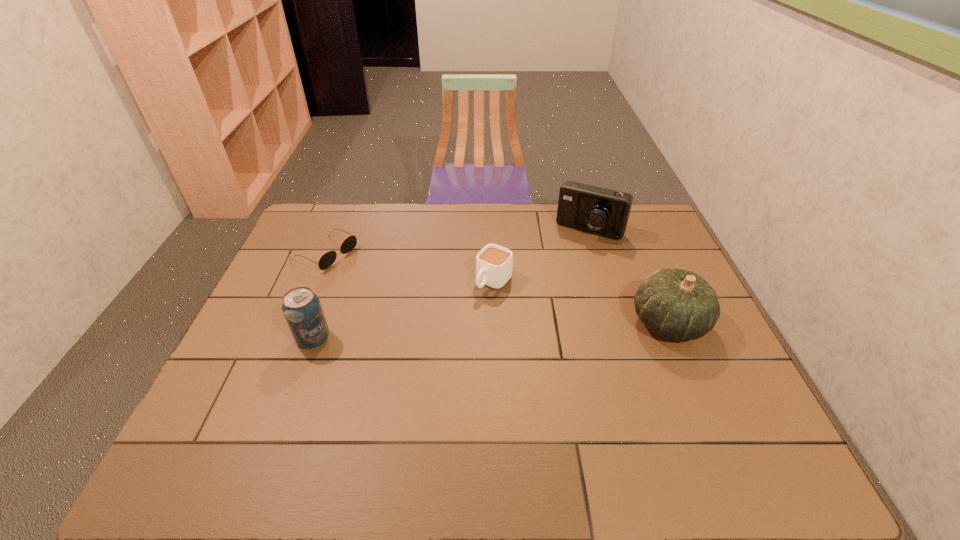
This screenshot has width=960, height=540. I want to click on pop soda, so click(x=302, y=309).

Locate an element on the screen. This screenshot has width=960, height=540. gourd is located at coordinates (677, 304).

Identify the location of sunglasses. The width and height of the screenshot is (960, 540). (327, 259).

This screenshot has height=540, width=960. In order to click on camera in this screenshot , I will do `click(597, 210)`.

The image size is (960, 540). Identify the location of cup. (494, 263).

This screenshot has height=540, width=960. In order to click on the second shortest object in this screenshot , I will do `click(494, 263)`.

Find the location of a particular element. free location located 0.070m on the front of the pop soda is located at coordinates (300, 374).

Where is `vacant space positioned on the front of the gourd`? This screenshot has height=540, width=960. vacant space positioned on the front of the gourd is located at coordinates (690, 374).

Find the location of a particular element. The height and width of the screenshot is (540, 960). free location located on the front-facing side of the sunglasses is located at coordinates (425, 300).

Locate an element on the screen. free space located on the front-facing side of the sunglasses is located at coordinates (381, 279).